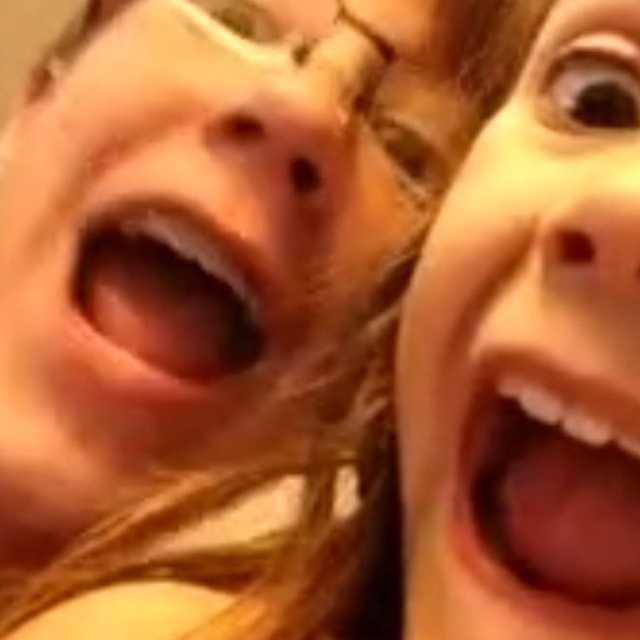
Can you confirm if smooth skin face at upper right is smaller than pink matte lips at center?

Actually, smooth skin face at upper right might be larger than pink matte lips at center.

Between point (620, 340) and point (218, 278), which one is positioned behind?

The point (218, 278) is behind.

The width and height of the screenshot is (640, 640). Find the location of `smooth skin face at upper right`. smooth skin face at upper right is located at coordinates (531, 356).

Measure the distance between pink glossy lips at center and pink matte lips at center.

The distance of pink glossy lips at center from pink matte lips at center is 10.15 inches.

Does point (564, 520) lie in front of point (202, 353)?

Yes, it is in front of point (202, 353).

Is point (624, 483) closer to camera compared to point (118, 244)?

Yes.

Locate an element on the screen. The image size is (640, 640). pink glossy lips at center is located at coordinates (550, 493).

Is smooth skin face at upper right taller than pink glossy lips at center?

Yes.

Who is more forward, (x=545, y=595) or (x=548, y=500)?

Positioned in front is point (x=545, y=595).

At what (x,y) coordinates should I click in order to perform the action: click on smooth skin face at upper right. Please return your answer as a coordinate pair (x, y). Looking at the image, I should click on (531, 356).